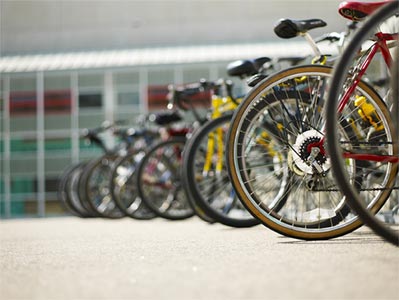
This screenshot has height=300, width=399. What are the coordinates of `seats` in the screenshot? It's located at (366, 8), (303, 21), (243, 62), (199, 82), (182, 87), (161, 110), (136, 120), (115, 122).